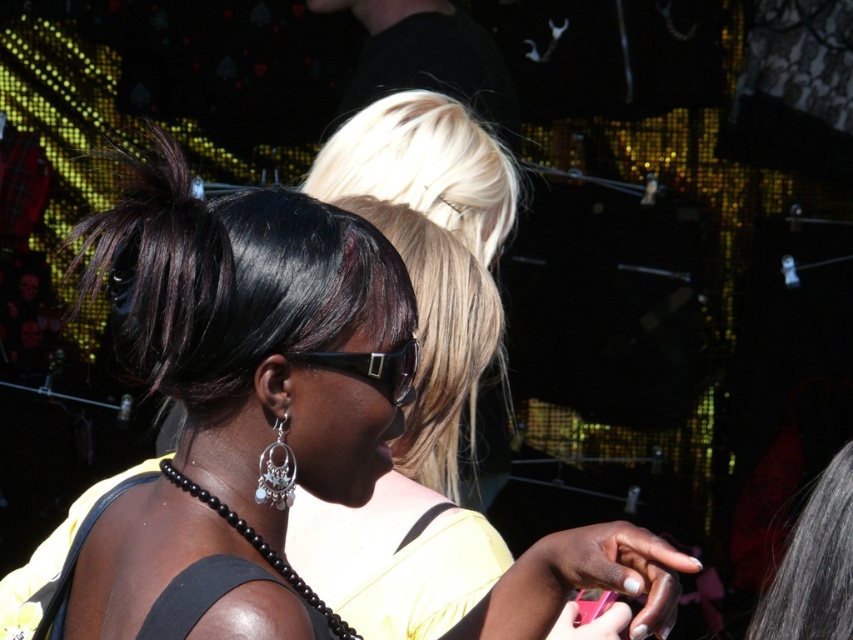
Which of these two, gray silky hair at upper right or black plastic sunglasses at center, stands shorter?

Standing shorter between the two is black plastic sunglasses at center.

Between gray silky hair at upper right and black plastic sunglasses at center, which one is positioned higher?

black plastic sunglasses at center

Is point (845, 550) behind point (408, 349)?

Yes, point (845, 550) is behind point (408, 349).

Locate an element on the screen. This screenshot has width=853, height=640. gray silky hair at upper right is located at coordinates (814, 564).

What are the coordinates of `black plastic sunglasses at center` in the screenshot? It's located at (373, 368).

Can you confirm if black plastic sunglasses at center is positioned to the left of pink plastic smartphone at lower right?

Indeed, black plastic sunglasses at center is positioned on the left side of pink plastic smartphone at lower right.

I want to click on black plastic sunglasses at center, so click(x=373, y=368).

This screenshot has width=853, height=640. What are the coordinates of `black plastic sunglasses at center` in the screenshot? It's located at (373, 368).

Can you confirm if gray silky hair at upper right is bigger than silver metallic dangling earring at center?

Correct, gray silky hair at upper right is larger in size than silver metallic dangling earring at center.

From the picture: Does gray silky hair at upper right appear on the left side of silver metallic dangling earring at center?

Incorrect, gray silky hair at upper right is not on the left side of silver metallic dangling earring at center.

This screenshot has width=853, height=640. What do you see at coordinates (814, 564) in the screenshot? I see `gray silky hair at upper right` at bounding box center [814, 564].

What are the coordinates of `gray silky hair at upper right` in the screenshot? It's located at (814, 564).